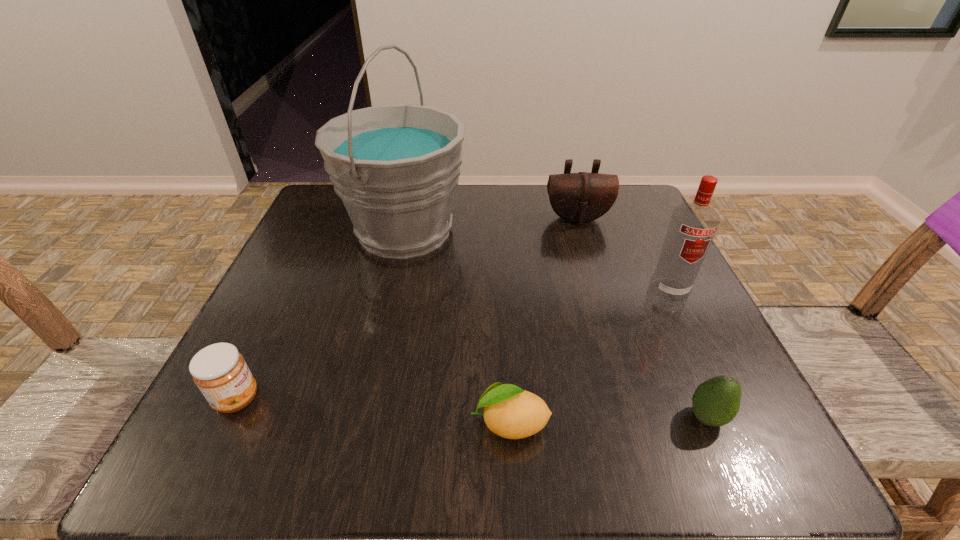
The image size is (960, 540). Find the location of `vacant space in between the lemon and the pouch`. vacant space in between the lemon and the pouch is located at coordinates (543, 321).

At what (x,y) coordinates should I click in order to perform the action: click on empty space that is in between the avocado and the shortest object. Please return your answer as a coordinate pair (x, y). This screenshot has width=960, height=540. Looking at the image, I should click on point(609,420).

Locate an element on the screen. free space between the avocado and the shortest object is located at coordinates (609, 420).

This screenshot has height=540, width=960. What are the coordinates of `vacant region between the shortest object and the tallest object` in the screenshot? It's located at pos(457,327).

What are the coordinates of `free spot between the avocado and the jam` in the screenshot? It's located at (472, 408).

Locate an element on the screen. The height and width of the screenshot is (540, 960). free area in between the shortest object and the jam is located at coordinates point(373,411).

Point out which object is positioned as the nearest to the fourth object from right to left. Please provide its 2D coordinates. Your answer should be formatted as a tuple, i.e. [(x, y)], where the tuple contains the x and y coordinates of a point satisfying the conditions above.

[(715, 402)]

Locate which object ranks in proximity to the avocado. Please provide its 2D coordinates. Your answer should be formatted as a tuple, i.e. [(x, y)], where the tuple contains the x and y coordinates of a point satisfying the conditions above.

[(510, 412)]

Image resolution: width=960 pixels, height=540 pixels. In order to click on vacant space that satisfies the following two spatial constraints: 1. on the front label of the avocado; 2. on the left side of the leftmost object in this screenshot , I will do `click(228, 417)`.

Where is `vacant space that satisfies the following two spatial constraints: 1. with the flap open on the avocado; 2. on the right side of the fourth shortest object`? The height and width of the screenshot is (540, 960). vacant space that satisfies the following two spatial constraints: 1. with the flap open on the avocado; 2. on the right side of the fourth shortest object is located at coordinates (636, 417).